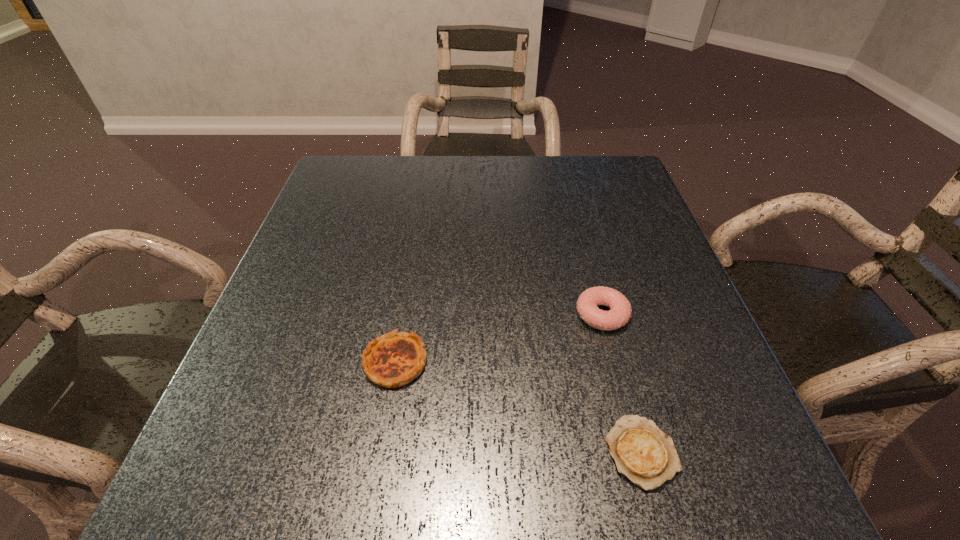
Where is `free spot between the second tallest object and the farthest object`? Image resolution: width=960 pixels, height=540 pixels. free spot between the second tallest object and the farthest object is located at coordinates (498, 338).

At what (x,y) coordinates should I click in order to perform the action: click on unoccupied area between the left quiche and the farthest object. Please return your answer as a coordinate pair (x, y). Looking at the image, I should click on (498, 338).

This screenshot has height=540, width=960. What are the coordinates of `vacant space in between the shorter quiche and the doughnut` in the screenshot? It's located at click(621, 383).

The image size is (960, 540). Find the location of `free point between the taller quiche and the nearest object`. free point between the taller quiche and the nearest object is located at coordinates (518, 407).

Find the location of a particular element. The image size is (960, 540). empty space that is in between the doughnut and the left quiche is located at coordinates (498, 338).

The height and width of the screenshot is (540, 960). Identify the location of blank region between the leftmost object and the right quiche. (518, 407).

Where is `empty space that is in between the shorter quiche and the doughnut`? Image resolution: width=960 pixels, height=540 pixels. empty space that is in between the shorter quiche and the doughnut is located at coordinates (621, 383).

This screenshot has height=540, width=960. In order to click on free space between the nearer quiche and the leftmost object in this screenshot , I will do `click(518, 407)`.

I want to click on free space between the nearest object and the farther quiche, so click(518, 407).

Locate an element on the screen. object that is the second nearest to the doughnut is located at coordinates (394, 359).